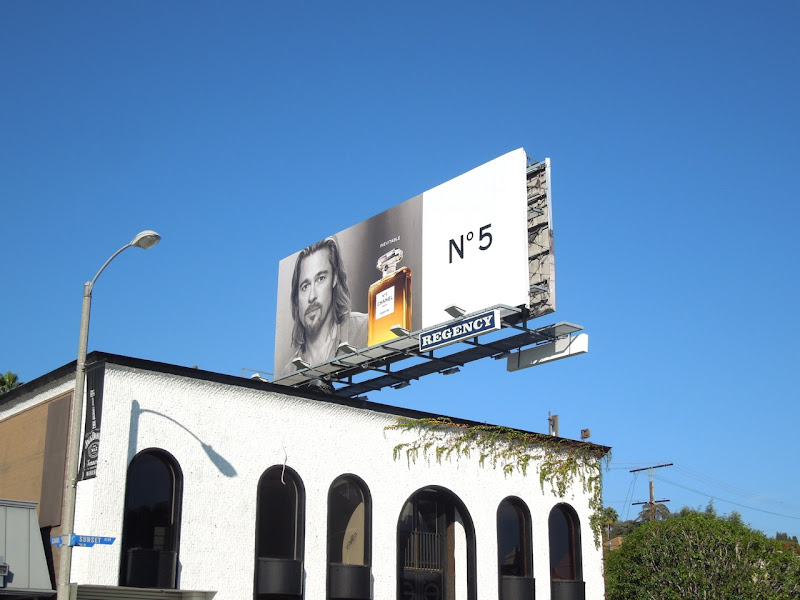
This screenshot has height=600, width=800. Identify the location of yellow purfume bottle. (385, 320).